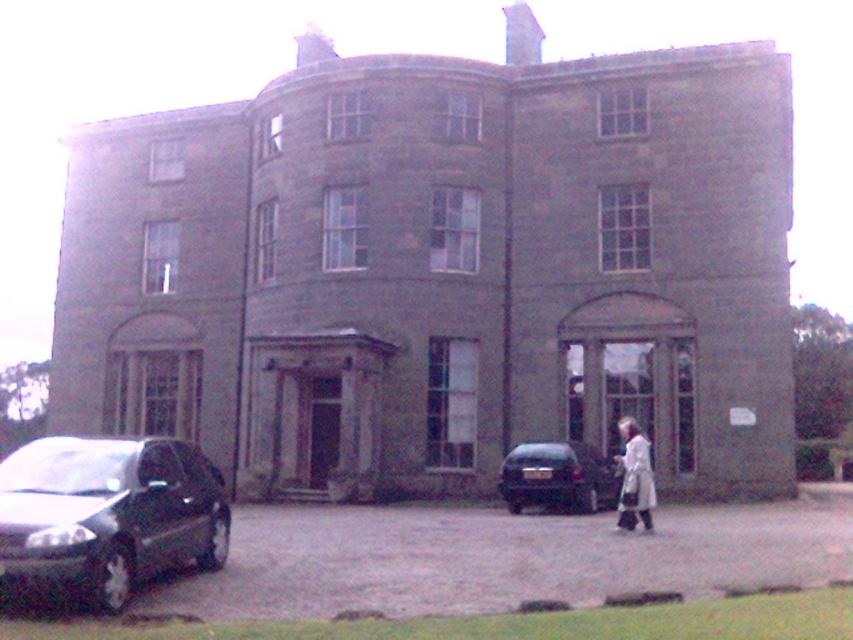
You are standing in front of the building and notice two points marked on its facade. The first point is located at coordinate point (567, 497) and the second at point (630, 420). Which of these points is positioned closer to your current viewpoint?

Point (567, 497) is closer to the viewer than point (630, 420).

You are a visitor approaching the entrance of the building. You see a shiny black car at lower center and a white clothed figure at center. Which object is closer to the entrance?

The shiny black car at lower center is closer to the entrance because it is located below the white clothed figure at center, indicating it is positioned lower and nearer to the entrance area.

You are a delivery person trying to park your shiny black car at lower left near the entrance of the building. There is a white clothed figure at center standing in the path. Can you safely maneuver the car around them without getting too close?

The shiny black car at lower left might be wider than the white clothed figure at center, so you need to ensure there is enough space to maneuver around them safely. Since the car could be wider, you should proceed cautiously to avoid collision.